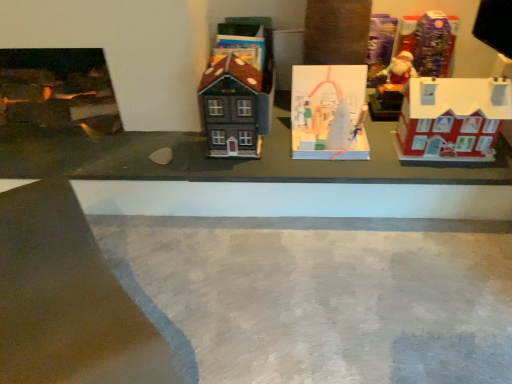
Question: Which direction should I rotate to look at matte brown house at center, positioned as the first toy in left-to-right order?

Choices:
 (A) right
 (B) left

Answer: (B)

Question: From a real-world perspective, is gray concrete at center on top of shiny plastic santa at upper right, which appears as the 5th toy when viewed from the left?

Choices:
 (A) yes
 (B) no

Answer: (B)

Question: Can you confirm if gray concrete at center is shorter than shiny plastic santa at upper right, which appears as the 5th toy when viewed from the left?

Choices:
 (A) yes
 (B) no

Answer: (A)

Question: Considering the relative sizes of gray concrete at center and shiny plastic santa at upper right, marked as the 1th toy in a right-to-left arrangement, in the image provided, is gray concrete at center bigger than shiny plastic santa at upper right, marked as the 1th toy in a right-to-left arrangement,?

Choices:
 (A) yes
 (B) no

Answer: (A)

Question: Is gray concrete at center at the right side of shiny plastic santa at upper right, marked as the 1th toy in a right-to-left arrangement?

Choices:
 (A) no
 (B) yes

Answer: (A)

Question: From a real-world perspective, is gray concrete at center beneath shiny plastic santa at upper right, marked as the 1th toy in a right-to-left arrangement?

Choices:
 (A) no
 (B) yes

Answer: (B)

Question: Can you confirm if gray concrete at center is thinner than shiny plastic santa at upper right, which appears as the 5th toy when viewed from the left?

Choices:
 (A) yes
 (B) no

Answer: (B)

Question: Considering the relative sizes of gray concrete at center and matte red house at right, the 4th toy when ordered from left to right, in the image provided, is gray concrete at center smaller than matte red house at right, the 4th toy when ordered from left to right,?

Choices:
 (A) yes
 (B) no

Answer: (B)

Question: Is gray concrete at center bigger than matte red house at right, placed as the 2th toy when sorted from right to left?

Choices:
 (A) no
 (B) yes

Answer: (B)

Question: From a real-world perspective, is gray concrete at center on matte red house at right, placed as the 2th toy when sorted from right to left?

Choices:
 (A) yes
 (B) no

Answer: (B)

Question: Can you confirm if gray concrete at center is taller than matte red house at right, placed as the 2th toy when sorted from right to left?

Choices:
 (A) yes
 (B) no

Answer: (B)

Question: From the image's perspective, is gray concrete at center on matte red house at right, the 4th toy when ordered from left to right?

Choices:
 (A) yes
 (B) no

Answer: (B)

Question: Is gray concrete at center further to the viewer compared to matte red house at right, placed as the 2th toy when sorted from right to left?

Choices:
 (A) no
 (B) yes

Answer: (A)

Question: From the image's perspective, is matte red house at right, the 4th toy when ordered from left to right, below gray concrete at center?

Choices:
 (A) yes
 (B) no

Answer: (B)